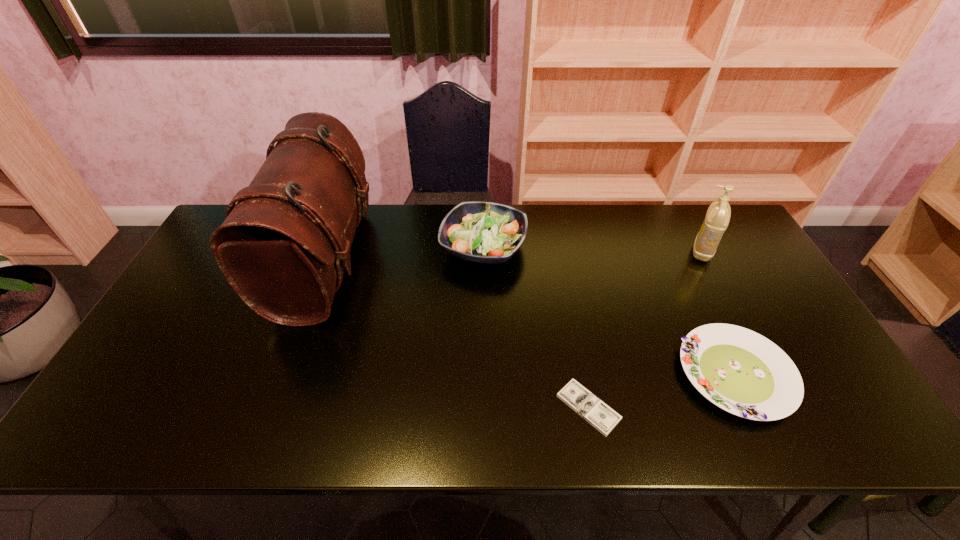
Identify the location of the tallest object. This screenshot has width=960, height=540. (282, 247).

Identify the location of satchel. The width and height of the screenshot is (960, 540). (282, 247).

Image resolution: width=960 pixels, height=540 pixels. I want to click on the second tallest object, so click(x=718, y=215).

Where is `the left salad plate`? The width and height of the screenshot is (960, 540). the left salad plate is located at coordinates (483, 232).

At what (x,y) coordinates should I click in order to perform the action: click on the taller salad plate. Please return your answer as a coordinate pair (x, y). This screenshot has width=960, height=540. Looking at the image, I should click on (483, 232).

Identify the location of the right salad plate. (742, 372).

Locate an element on the screen. This screenshot has width=960, height=540. the second shortest object is located at coordinates (742, 372).

The width and height of the screenshot is (960, 540). I want to click on dollar, so click(x=602, y=417).

At what (x,y) coordinates should I click in order to perform the action: click on the shortest object. Please return your answer as a coordinate pair (x, y). The image size is (960, 540). Looking at the image, I should click on (602, 417).

Identify the location of vacant space positioned 0.170m on the front-facing side of the tallest object. (424, 261).